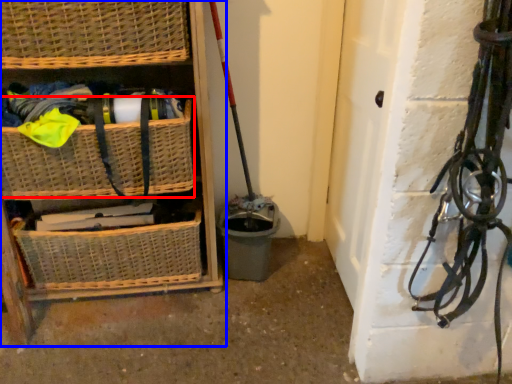
Question: Among these objects, which one is nearest to the camera, basket (highlighted by a red box) or shelf (highlighted by a blue box)?

Choices:
 (A) basket
 (B) shelf

Answer: (B)